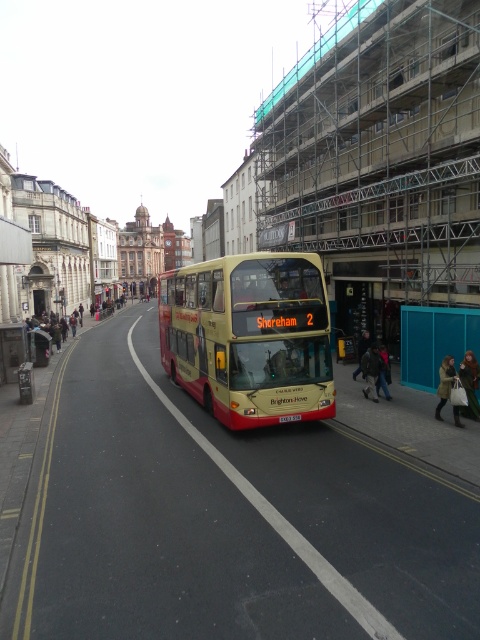
Question: Which point appears farthest from the camera in this image?

Choices:
 (A) (439, 371)
 (B) (466, 413)

Answer: (A)

Question: Among these objects, which one is farthest from the camera?

Choices:
 (A) dark brown leather jacket at lower right
 (B) teal fabric coat at lower right
 (C) yellow matte/decorative decker bus at center
 (D) green fabric coat at center

Answer: (A)

Question: Can you confirm if teal fabric coat at lower right is positioned to the right of dark brown leather jacket at lower right?

Choices:
 (A) yes
 (B) no

Answer: (A)

Question: Among these points, which one is farthest from the camera?

Choices:
 (A) (439, 419)
 (B) (370, 396)
 (C) (479, 369)
 (D) (307, 259)

Answer: (B)

Question: Does yellow matte/decorative decker bus at center have a lesser width compared to green fabric coat at center?

Choices:
 (A) no
 (B) yes

Answer: (A)

Question: Can you confirm if green fabric coat at center is positioned to the left of teal fabric coat at lower right?

Choices:
 (A) yes
 (B) no

Answer: (B)